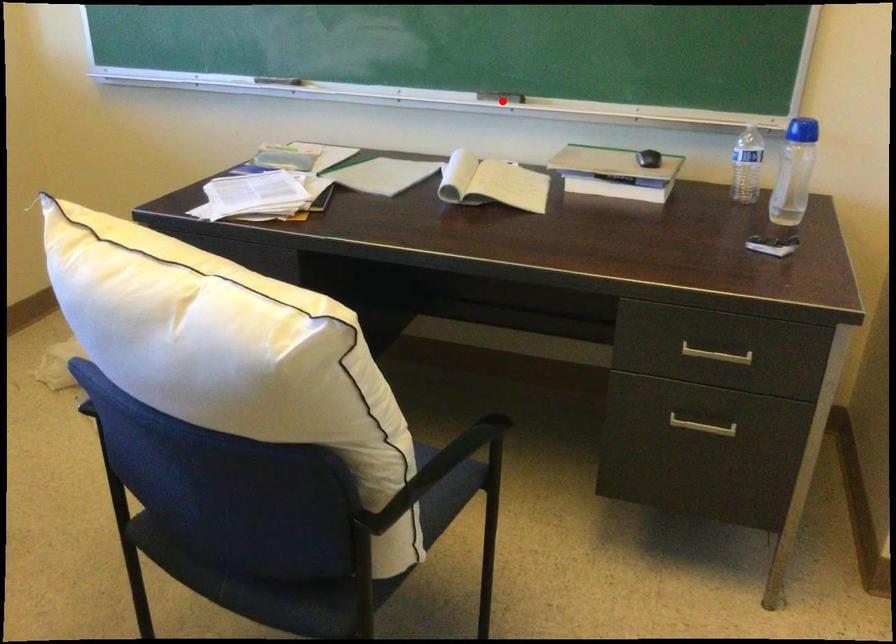
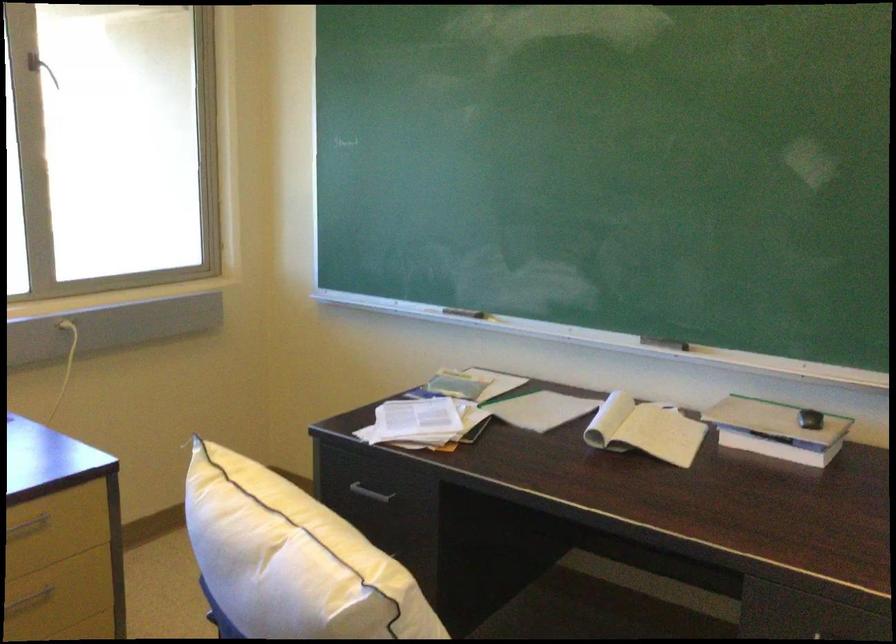
Locate, in the second image, the point that corresponds to the highlighted location in the first image.

(664, 343)